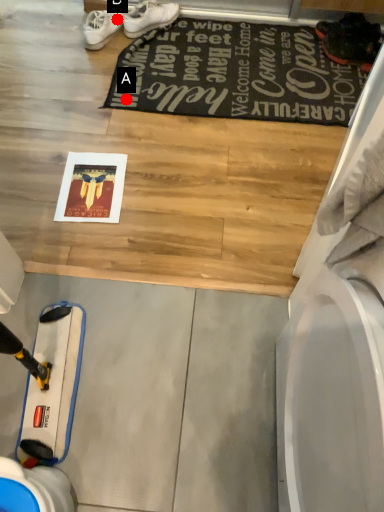
Question: Two points are circled on the image, labeled by A and B beside each circle. Among these points, which one is nearest to the camera?

Choices:
 (A) A is closer
 (B) B is closer

Answer: (A)